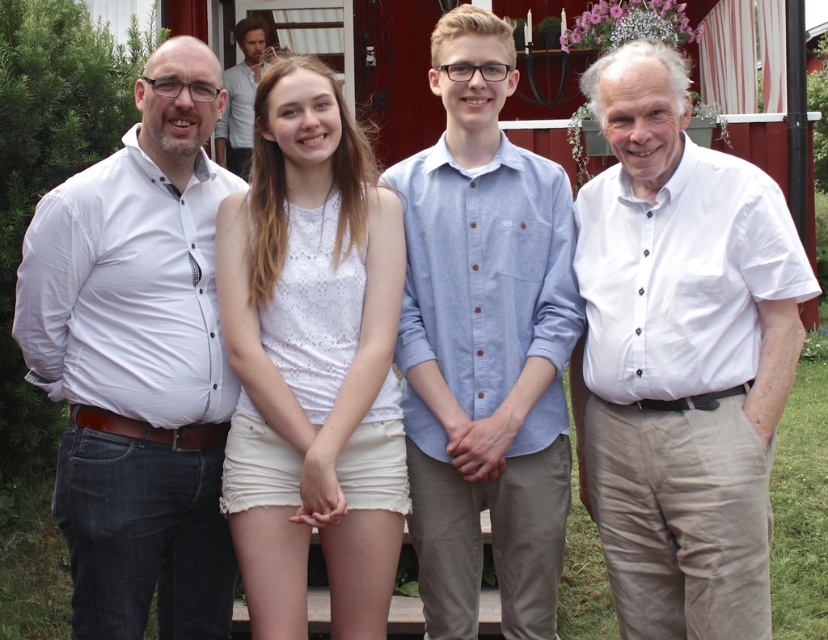
Question: In this image, where is white shirt at left located relative to smooth brown hair at upper center?

Choices:
 (A) right
 (B) left

Answer: (A)

Question: Can you confirm if light blue chambray shirt at center is positioned to the left of white lace top at center?

Choices:
 (A) yes
 (B) no

Answer: (B)

Question: Which point is closer to the camera?

Choices:
 (A) white cotton shirt at right
 (B) white shirt at left
 (C) light blue chambray shirt at center

Answer: (A)

Question: Which point is closer to the camera?

Choices:
 (A) (217, 285)
 (B) (749, 218)

Answer: (B)

Question: Is white shirt at left further to the viewer compared to light blue chambray shirt at center?

Choices:
 (A) no
 (B) yes

Answer: (A)

Question: Which is farther from the white shirt at left?

Choices:
 (A) light blue chambray shirt at center
 (B) white lace top at center

Answer: (A)